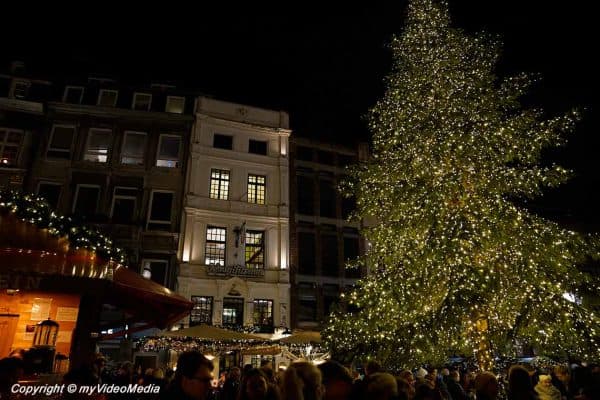
This screenshot has height=400, width=600. Identify the location of windows. click(x=219, y=190), click(x=255, y=192), click(x=258, y=240), click(x=221, y=242), click(x=205, y=322), click(x=226, y=315), click(x=261, y=318).